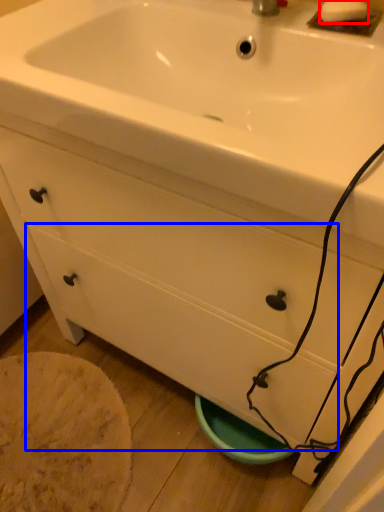
Question: Among these objects, which one is nearest to the camera, soap (highlighted by a red box) or drawer (highlighted by a blue box)?

Choices:
 (A) soap
 (B) drawer

Answer: (A)